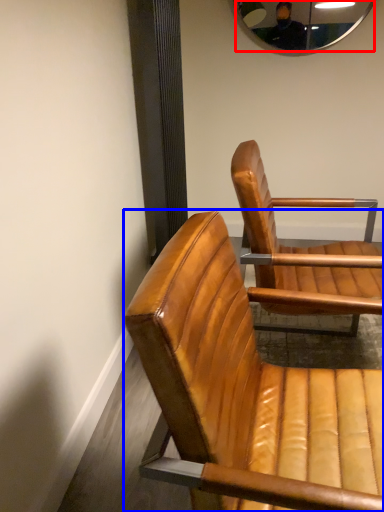
Question: Which object is closer to the camera taking this photo, mirror (highlighted by a red box) or chair (highlighted by a blue box)?

Choices:
 (A) mirror
 (B) chair

Answer: (B)